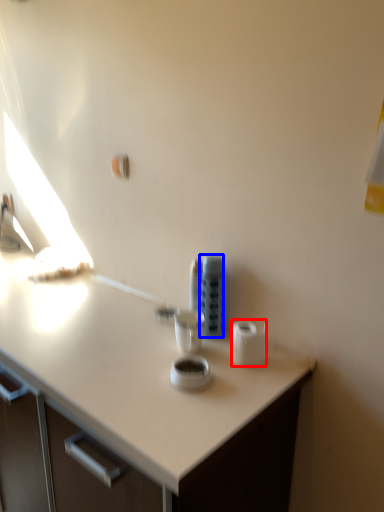
Question: Which object appears closest to the camera in this image, toilet paper (highlighted by a red box) or appliance (highlighted by a blue box)?

Choices:
 (A) toilet paper
 (B) appliance

Answer: (A)